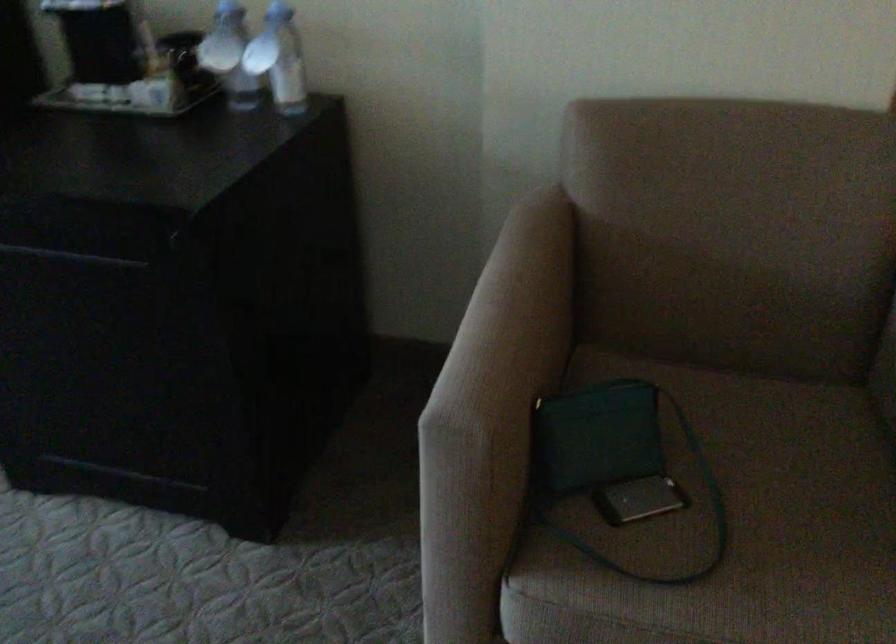
Where would you rest the chair armrest? Please return your answer as a coordinate pair (x, y).

(495, 390)